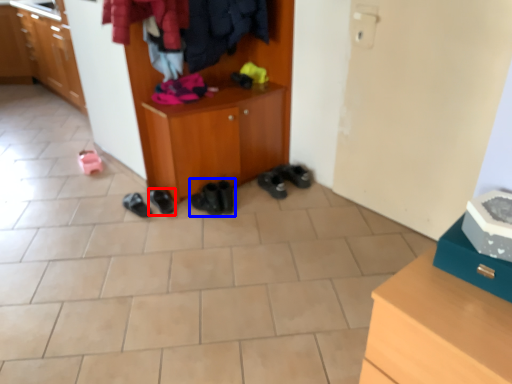
Question: Which object is further to the camera taking this photo, footwear (highlighted by a red box) or footwear (highlighted by a blue box)?

Choices:
 (A) footwear
 (B) footwear

Answer: (A)